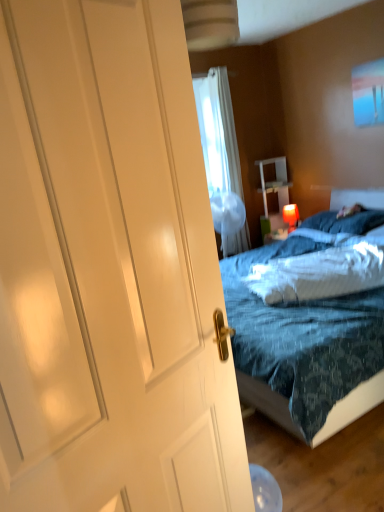
The height and width of the screenshot is (512, 384). Identify the location of vacant point above white glossy nightstand at center (from a real-world perspective). (270, 159).